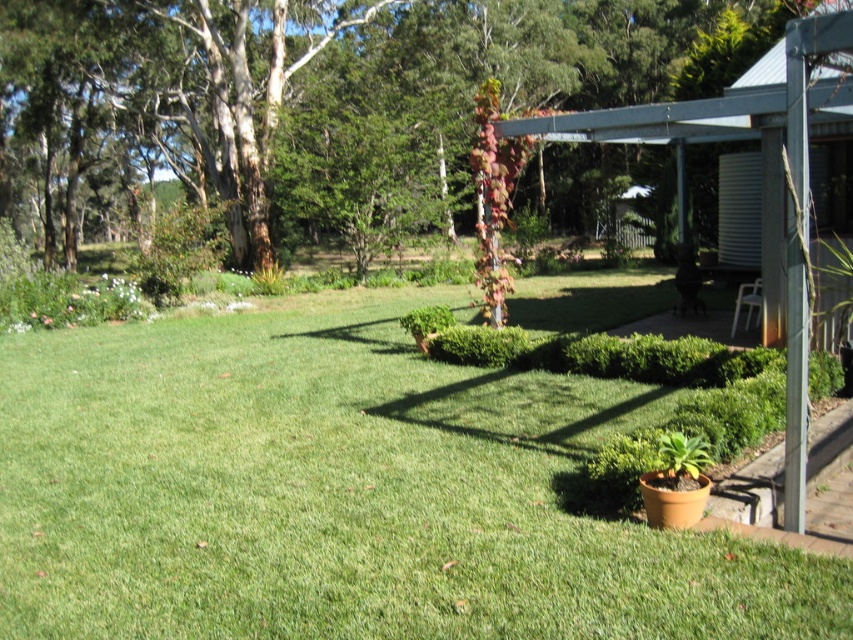
You are planning to install a small garden shed in your backyard. You want to place it in an area that has enough space. Based on the image, which location would be more suitable for the shed between the green grass at lower left and the brown textured tree at upper left?

The green grass at lower left has a smaller size compared to the brown textured tree at upper left, so the brown textured tree at upper left would provide more space for the shed.

You are planning to install a new lighting system in the backyard. You need to place a spotlight on the metallic gray pergola at upper right. However, there is a brown textured tree at upper left in the way. Will the tree block the light from reaching the pergola?

The brown textured tree at upper left is positioned over the metallic gray pergola at upper right, so it will block the light from reaching the pergola.